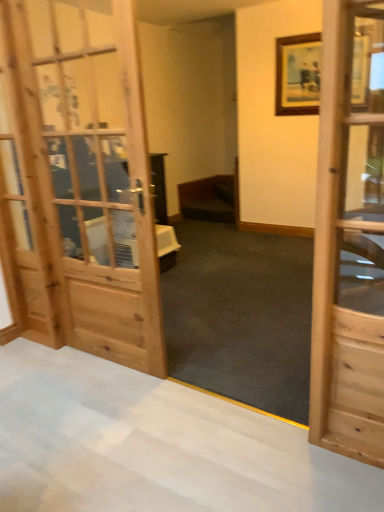
Question: Is point (357, 193) positioned closer to the camera than point (233, 200)?

Choices:
 (A) farther
 (B) closer

Answer: (B)

Question: Visually, is wooden door at right positioned to the left or to the right of dark wood bed at center?

Choices:
 (A) right
 (B) left

Answer: (A)

Question: From a real-world perspective, is wooden door at right positioned above or below dark wood bed at center?

Choices:
 (A) below
 (B) above

Answer: (B)

Question: Based on their sizes in the image, would you say dark wood bed at center is bigger or smaller than wooden door at right?

Choices:
 (A) small
 (B) big

Answer: (B)

Question: From a real-world perspective, is dark wood bed at center physically located above or below wooden door at right?

Choices:
 (A) above
 (B) below

Answer: (B)

Question: From the image's perspective, is dark wood bed at center above or below wooden door at right?

Choices:
 (A) above
 (B) below

Answer: (A)

Question: Is dark wood bed at center taller or shorter than wooden door at right?

Choices:
 (A) short
 (B) tall

Answer: (A)